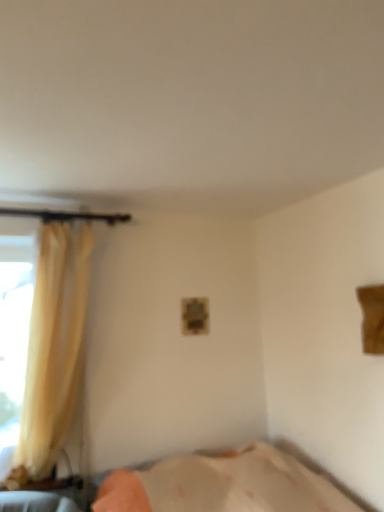
Question: Is silky yellow curtain at left to the left or to the right of beige fabric bed at lower center in the image?

Choices:
 (A) left
 (B) right

Answer: (A)

Question: From the image's perspective, is silky yellow curtain at left located above or below beige fabric bed at lower center?

Choices:
 (A) above
 (B) below

Answer: (A)

Question: Is silky yellow curtain at left taller or shorter than beige fabric bed at lower center?

Choices:
 (A) tall
 (B) short

Answer: (A)

Question: From the image's perspective, is beige fabric bed at lower center above or below silky yellow curtain at left?

Choices:
 (A) above
 (B) below

Answer: (B)

Question: Would you say beige fabric bed at lower center is inside or outside silky yellow curtain at left?

Choices:
 (A) inside
 (B) outside

Answer: (B)

Question: Considering the positions of beige fabric bed at lower center and silky yellow curtain at left in the image, is beige fabric bed at lower center bigger or smaller than silky yellow curtain at left?

Choices:
 (A) small
 (B) big

Answer: (B)

Question: Visually, is beige fabric bed at lower center positioned to the left or to the right of silky yellow curtain at left?

Choices:
 (A) left
 (B) right

Answer: (B)